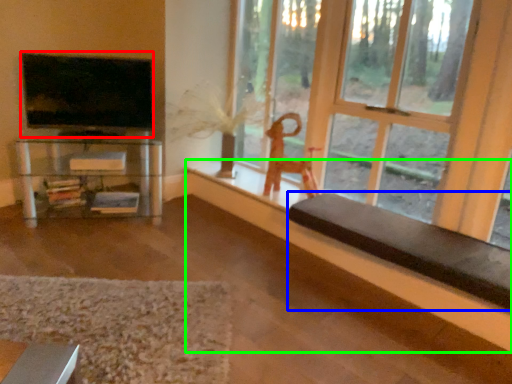
Question: Which object is the farthest from television (highlighted by a red box)? Choose among these: furniture (highlighted by a blue box) or ledge (highlighted by a green box).

Choices:
 (A) furniture
 (B) ledge

Answer: (A)